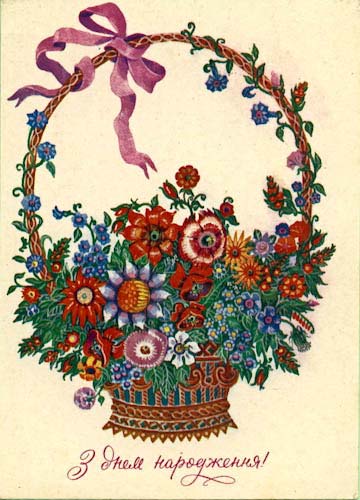
This screenshot has width=360, height=500. I want to click on purple flower in lower part of basket, so click(132, 342).